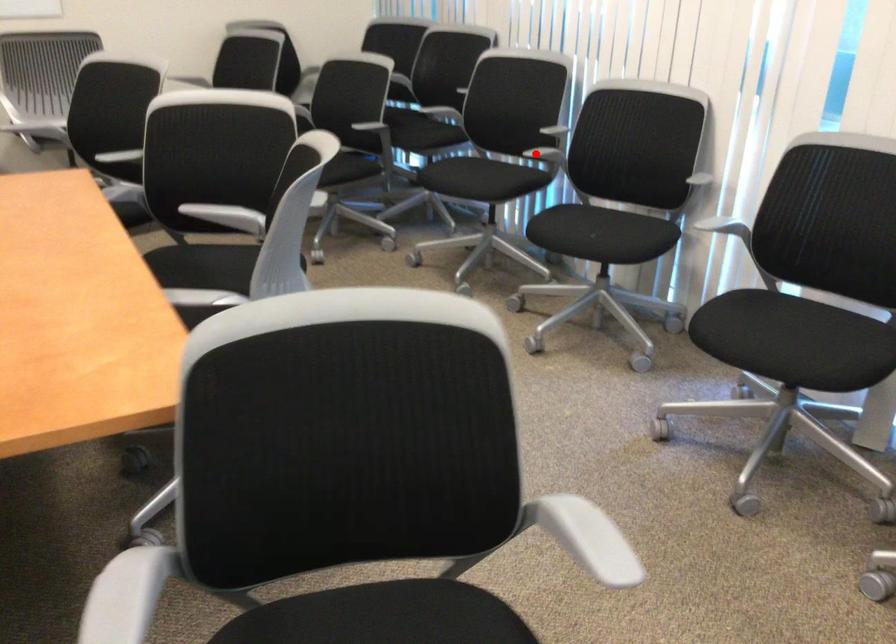
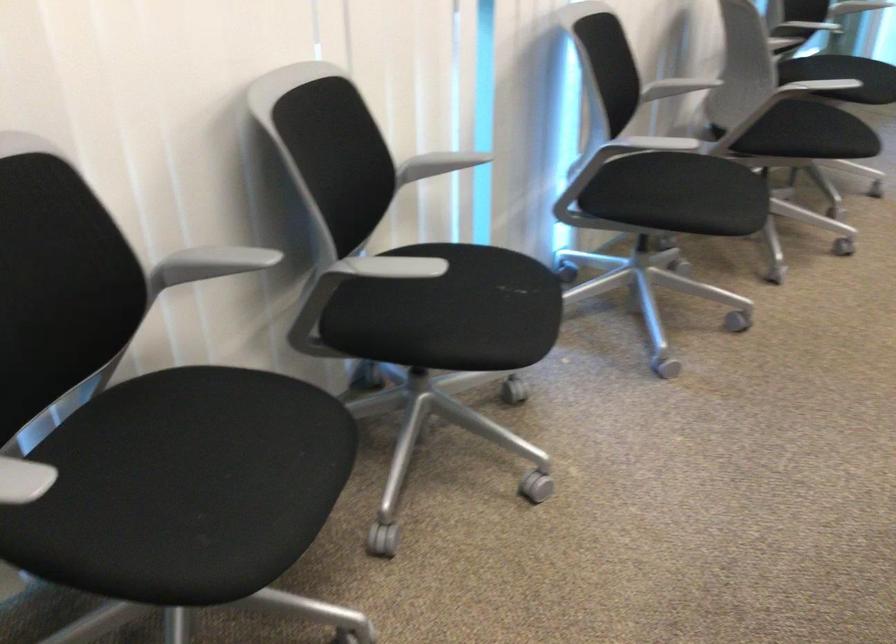
Question: I am providing you with two images of the same scene from different viewpoints. A red point is marked on the first image. Is the red point's position out of view in image 2?

Choices:
 (A) Yes
 (B) No

Answer: (B)